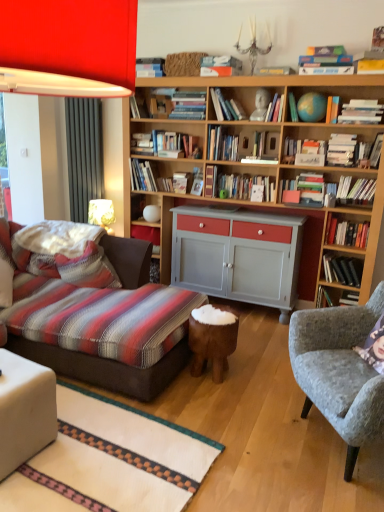
Find the location of a particular element. Image resolution: width=384 pixels, height=512 pixels. free spot above hardcover book at upper right, the tenth book when ordered from left to right (from a real-world perspective) is located at coordinates (314, 134).